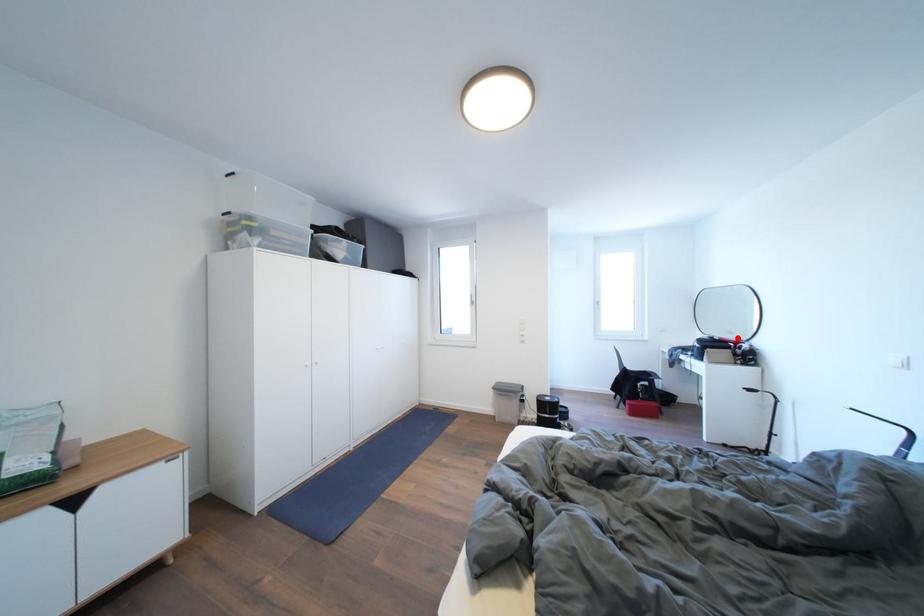
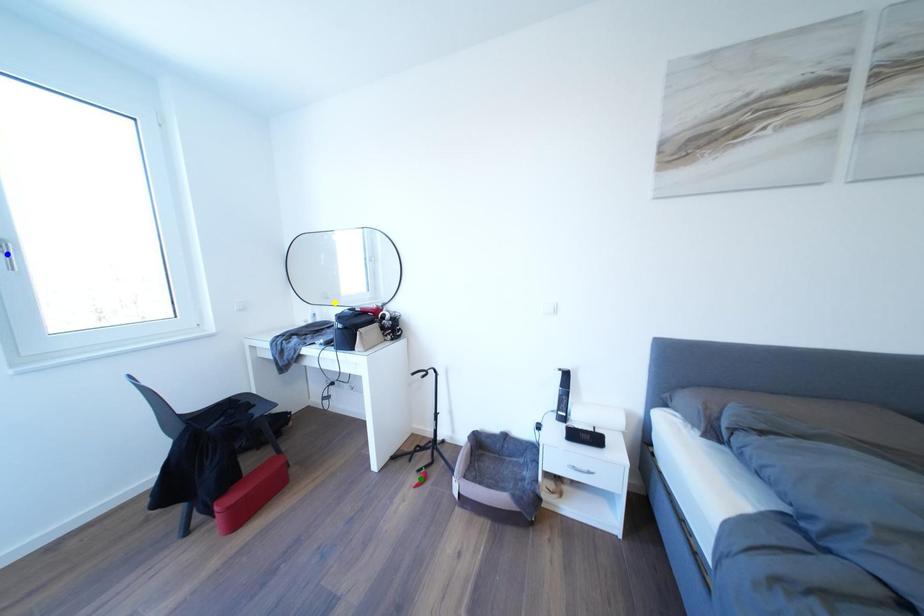
Question: I am providing you with two images of the same scene from different viewpoints. A red point is marked on the first image. You are given multiple points on the second image. In image 2, which mark is for the same physical point as the one in image 1?

Choices:
 (A) green point
 (B) yellow point
 (C) blue point

Answer: (B)